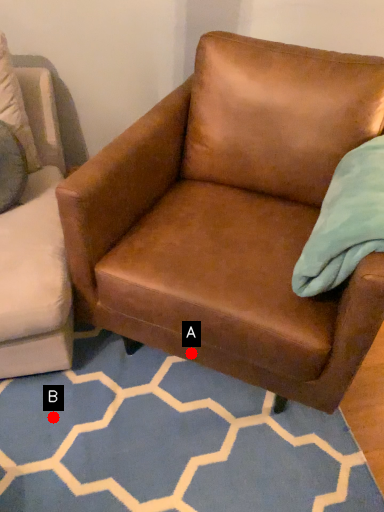
Question: Two points are circled on the image, labeled by A and B beside each circle. Among these points, which one is farthest from the camera?

Choices:
 (A) A is further
 (B) B is further

Answer: (B)